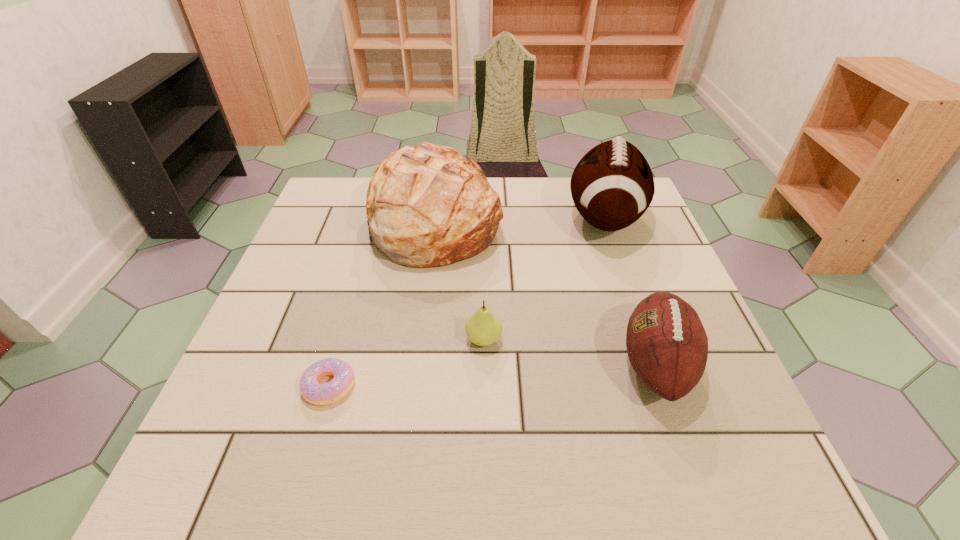
The height and width of the screenshot is (540, 960). In order to click on free space between the third tallest object and the pear in this screenshot , I will do `click(569, 352)`.

The width and height of the screenshot is (960, 540). What are the coordinates of `vacant region between the taller football (American) and the bread` in the screenshot? It's located at (519, 219).

The image size is (960, 540). I want to click on object that stands as the closest to the shorter football (American), so click(612, 186).

Identify which object is located as the third nearest to the pear. Please provide its 2D coordinates. Your answer should be formatted as a tuple, i.e. [(x, y)], where the tuple contains the x and y coordinates of a point satisfying the conditions above.

[(667, 345)]

I want to click on vacant area in the image that satisfies the following two spatial constraints: 1. on the front side of the bread; 2. on the right side of the pear, so click(418, 340).

At what (x,y) coordinates should I click in order to perform the action: click on free spot that satisfies the following two spatial constraints: 1. on the back side of the doughnut; 2. on the left side of the bread. Please return your answer as a coordinate pair (x, y). The image size is (960, 540). Looking at the image, I should click on (377, 220).

Identify the location of vacant region that satisfies the following two spatial constraints: 1. on the back side of the shortest object; 2. on the left side of the third tallest object. (336, 364).